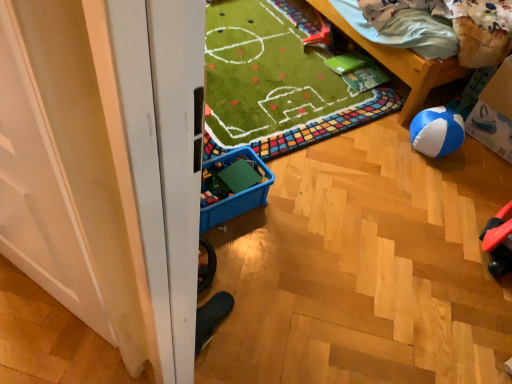
Question: Choose the correct answer: Is cardboard box at right inside blue plastic storage box at center or outside it?

Choices:
 (A) outside
 (B) inside

Answer: (A)

Question: Would you say cardboard box at right is to the left or to the right of blue plastic storage box at center in the picture?

Choices:
 (A) right
 (B) left

Answer: (A)

Question: Estimate the real-world distances between objects in this image. Which object is closer to the cardboard box at right?

Choices:
 (A) blue plastic storage box at center
 (B) wooden bed at upper right
 (C) rubberized plastic toy at upper center

Answer: (B)

Question: Which of these objects is positioned closest to the blue plastic storage box at center?

Choices:
 (A) wooden bed at upper right
 (B) rubberized plastic toy at upper center
 (C) cardboard box at right

Answer: (A)